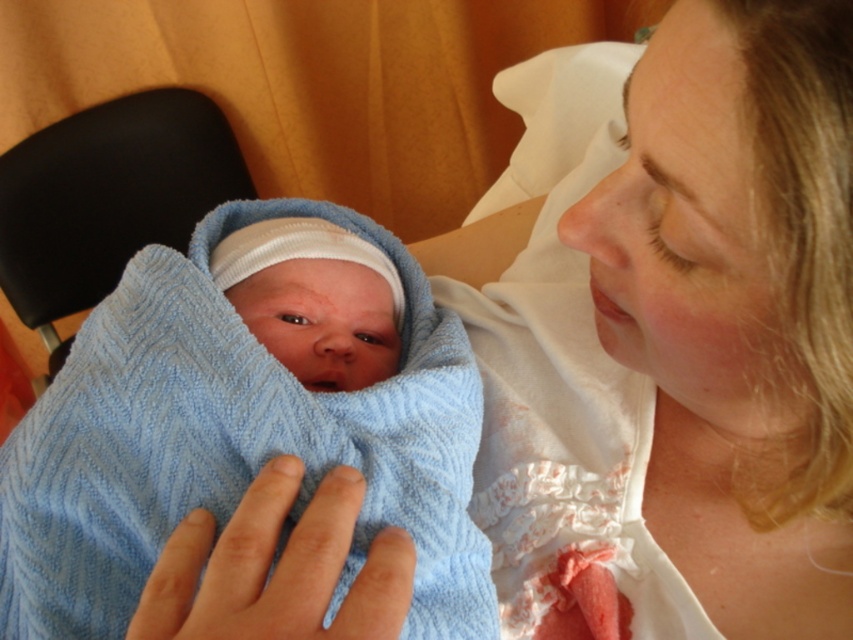
You are standing 24.35 inches away from a point marked at coordinates (256, 244). If you want to move closer to this point, which direction should you move?

Since you are currently 24.35 inches away from the point marked at coordinates (256, 244), you should move forward towards the point to get closer.